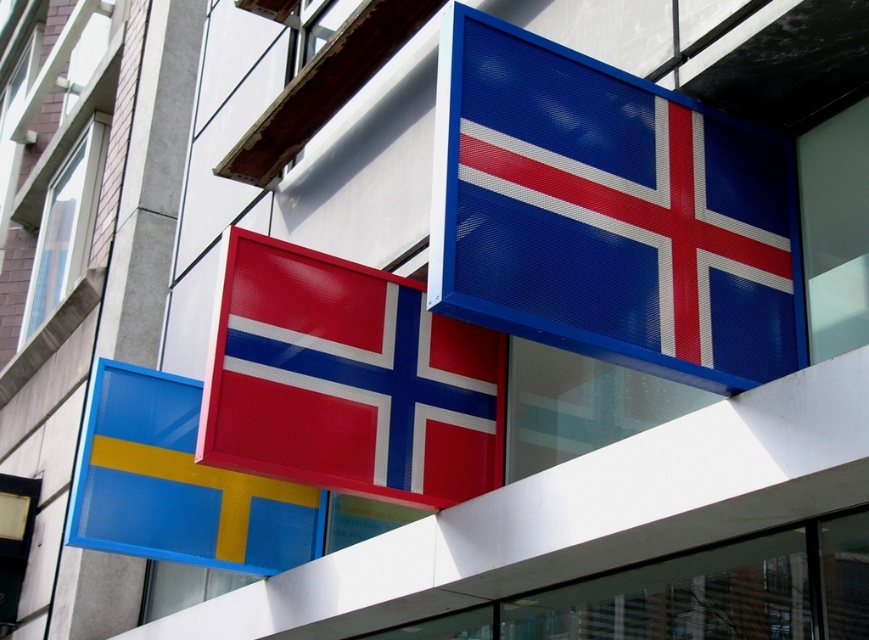
You are an architect reviewing the building facade and need to determine the visibility of two points marked on the facade. The points are labeled as point 1 at coordinates point (642, 333) and point 2 at coordinates point (196, 496). Which point is closer to the observer standing directly in front of the building?

Point (642, 333) is in front of point (196, 496), so point 1 is closer to the observer.

From the picture: You are an architect reviewing the facade design. You notice the blue mesh flag at upper right and the matte plastic flag at lower left. Which flag is positioned higher on the building facade?

The blue mesh flag at upper right is positioned higher on the building facade than the matte plastic flag at lower left.

You are an architect reviewing the facade design. The blue mesh flag at upper right and the metallic red flag at center are part of the installation. Which flag is positioned higher on the building facade?

The blue mesh flag at upper right is positioned higher on the building facade than the metallic red flag at center.